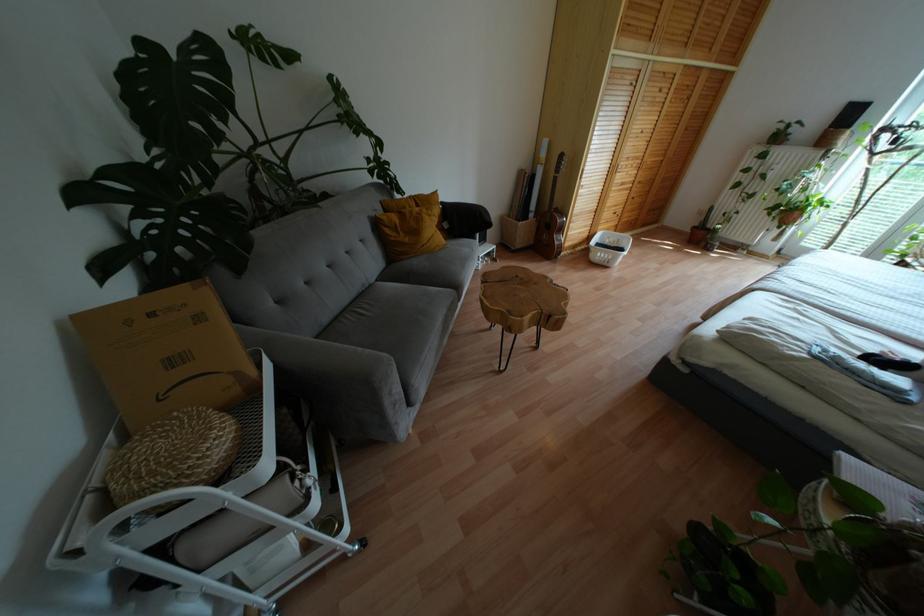
This screenshot has width=924, height=616. What are the coordinates of `white laundry basket` in the screenshot? It's located at (609, 248).